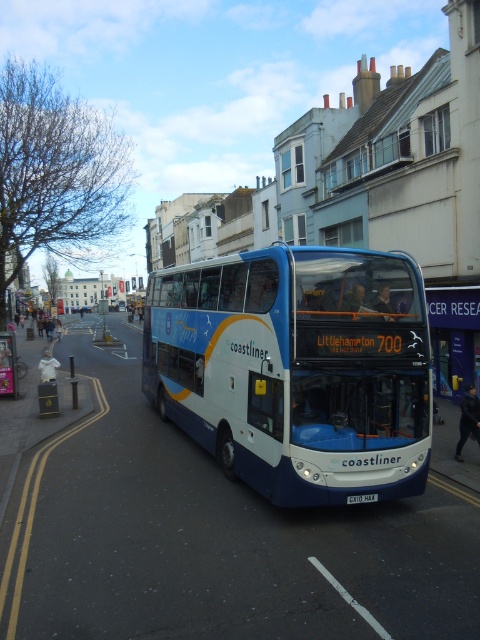
Is blue metallic bus at center further to the viewer compared to white plastic license plate at center?

That is False.

Can you confirm if blue metallic bus at center is thinner than white plastic license plate at center?

Yes.

The width and height of the screenshot is (480, 640). I want to click on blue metallic bus at center, so click(x=297, y=369).